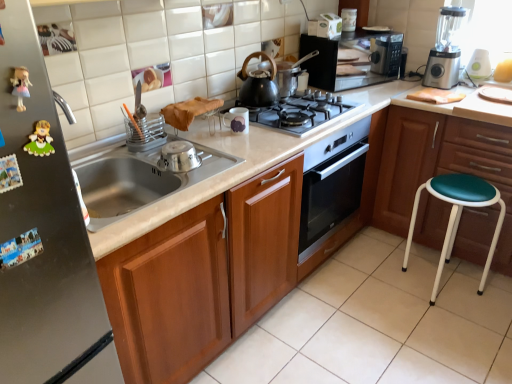
What are the coordinates of `unoccupied region to the right of white glossy mug at upper center, which is the second appliance from top to bottom` in the screenshot? It's located at (274, 131).